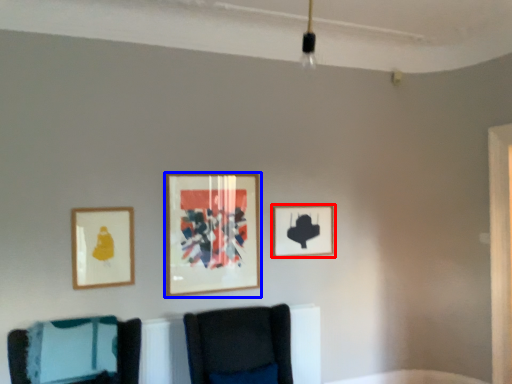
Question: Which object is further to the camera taking this photo, picture frame (highlighted by a red box) or picture frame (highlighted by a blue box)?

Choices:
 (A) picture frame
 (B) picture frame

Answer: (A)